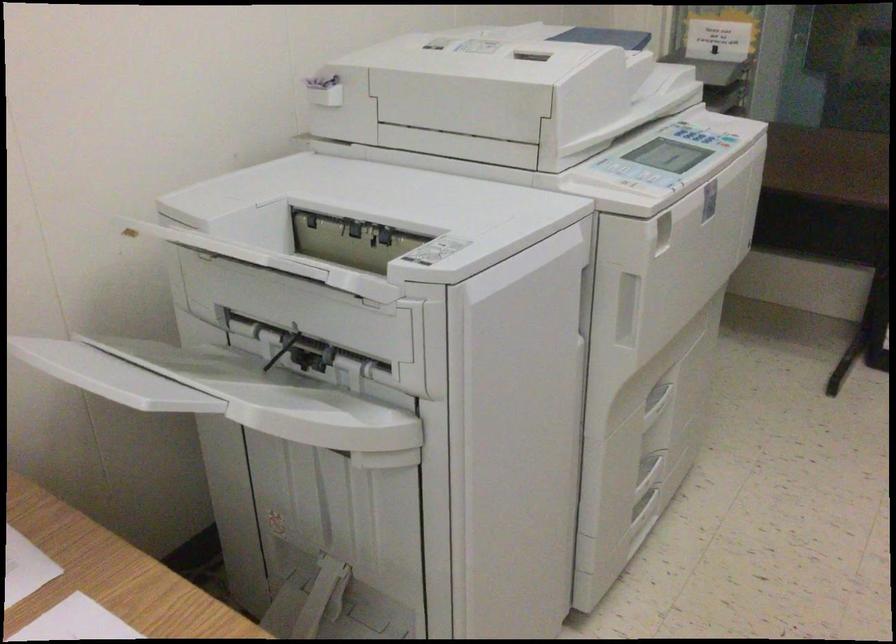
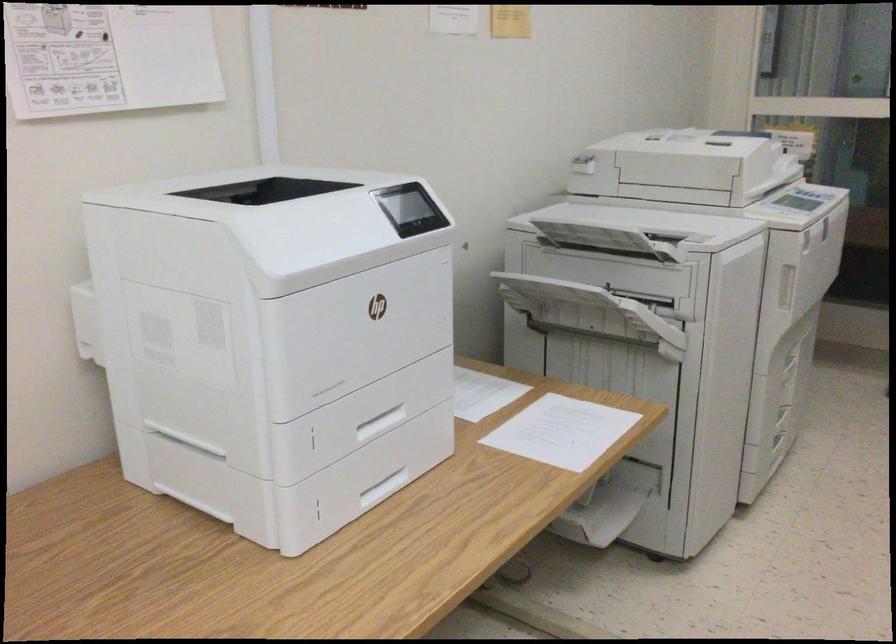
Question: I am providing you with two images of the same scene from different viewpoints. After the viewpoint changes to image2, which objects are now occluded?

Choices:
 (A) refrigerator door edge
 (B) copier tray handle
 (C) scanner lid
 (D) copier button

Answer: (B)